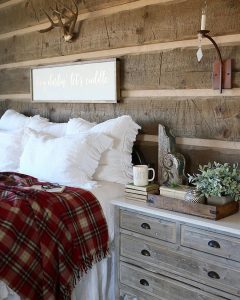
Where is `plant`? The height and width of the screenshot is (300, 240). plant is located at coordinates (220, 176).